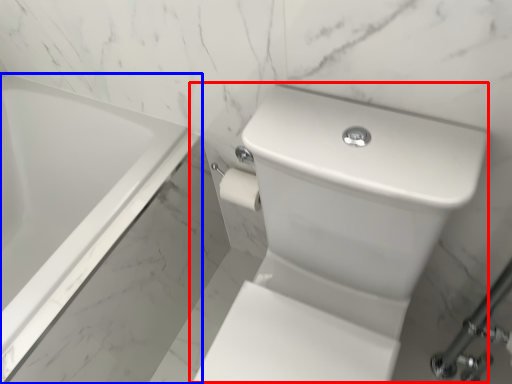
Question: Which object is closer to the camera taking this photo, sink (highlighted by a red box) or bathtub (highlighted by a blue box)?

Choices:
 (A) sink
 (B) bathtub

Answer: (A)